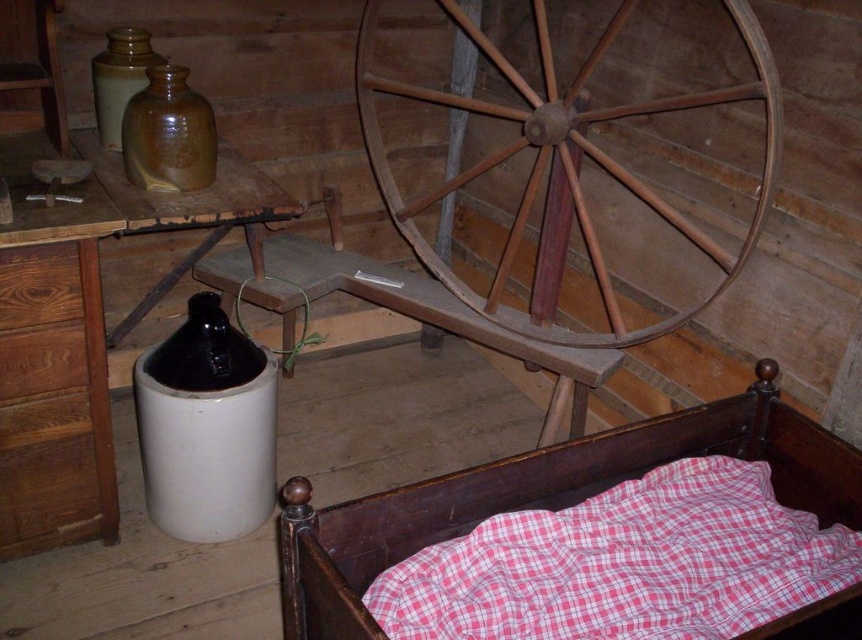
Is brown matte bottle at upper left above matte brown jug at upper left?

No.

Can you confirm if brown matte bottle at upper left is wider than matte brown jug at upper left?

Indeed, brown matte bottle at upper left has a greater width compared to matte brown jug at upper left.

Where is `brown matte bottle at upper left`? brown matte bottle at upper left is located at coordinates click(167, 132).

Is wooden bed frame at lower right to the right of matte brown jug at upper left from the viewer's perspective?

Indeed, wooden bed frame at lower right is positioned on the right side of matte brown jug at upper left.

Who is more distant from viewer, (800, 413) or (94, 72)?

The point (94, 72) is behind.

The width and height of the screenshot is (862, 640). I want to click on wooden bed frame at lower right, so click(x=542, y=497).

Who is more distant from viewer, (x=853, y=632) or (x=151, y=113)?

Point (x=151, y=113)

Which is behind, point (610, 460) or point (191, 179)?

Positioned behind is point (191, 179).

You are a GUI agent. You are given a task and a screenshot of the screen. Output one action in this format:
    pyautogui.click(x=<x>, y=<y>)
    Task: Click on the wooden bed frame at lower right
    
    Given the screenshot: What is the action you would take?
    pyautogui.click(x=542, y=497)